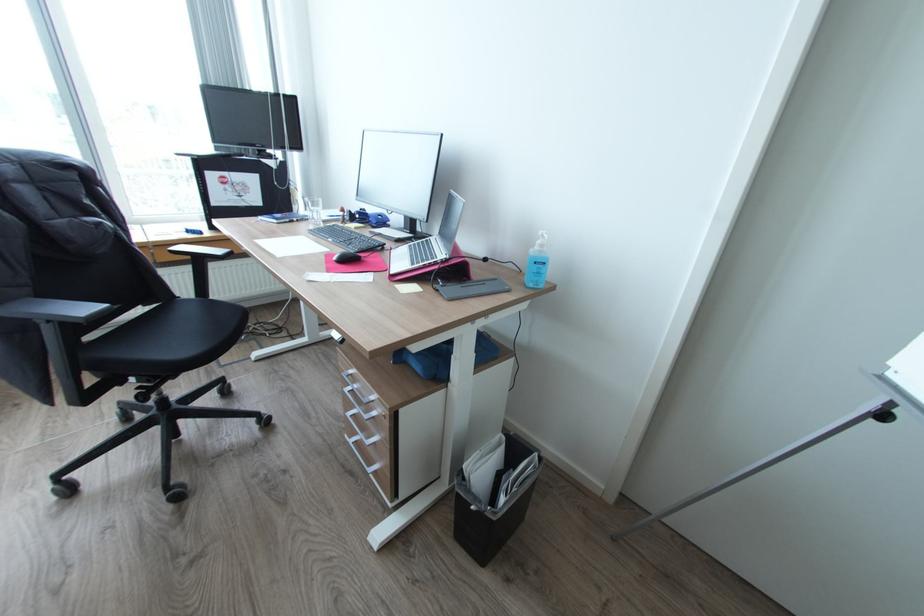
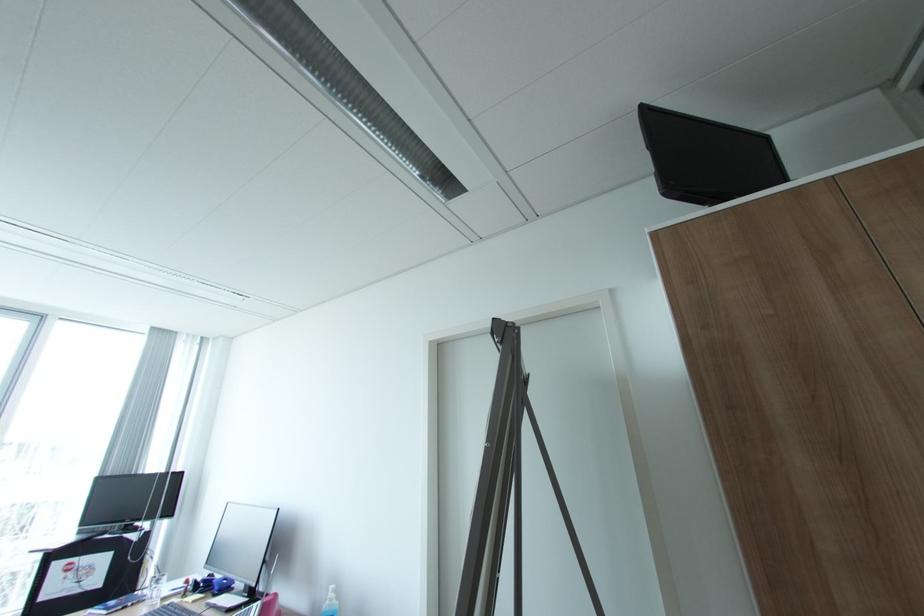
In the second image, find the point that corresponds to (x=321, y=217) in the first image.

(160, 596)